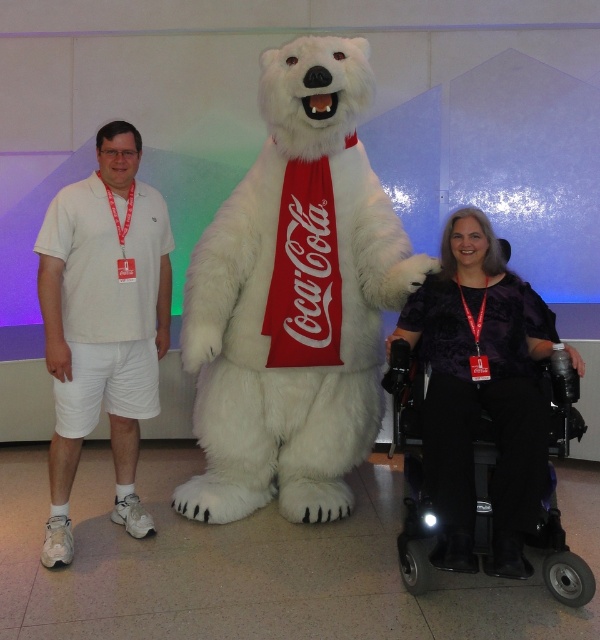
Question: Is white plush bear at center bigger than white cotton shorts at left?

Choices:
 (A) no
 (B) yes

Answer: (B)

Question: Among these points, which one is nearest to the camera?

Choices:
 (A) (117, 140)
 (B) (526, 506)

Answer: (B)

Question: Which object is the farthest from the purple satin dress at lower right?

Choices:
 (A) white cotton shorts at left
 (B) white plush bear at center

Answer: (A)

Question: Considering the real-world distances, which object is closest to the purple satin dress at lower right?

Choices:
 (A) white plush bear at center
 (B) white cotton shorts at left

Answer: (A)

Question: Is white plush bear at center positioned behind purple satin dress at lower right?

Choices:
 (A) no
 (B) yes

Answer: (B)

Question: Is white plush bear at center above purple satin dress at lower right?

Choices:
 (A) yes
 (B) no

Answer: (A)